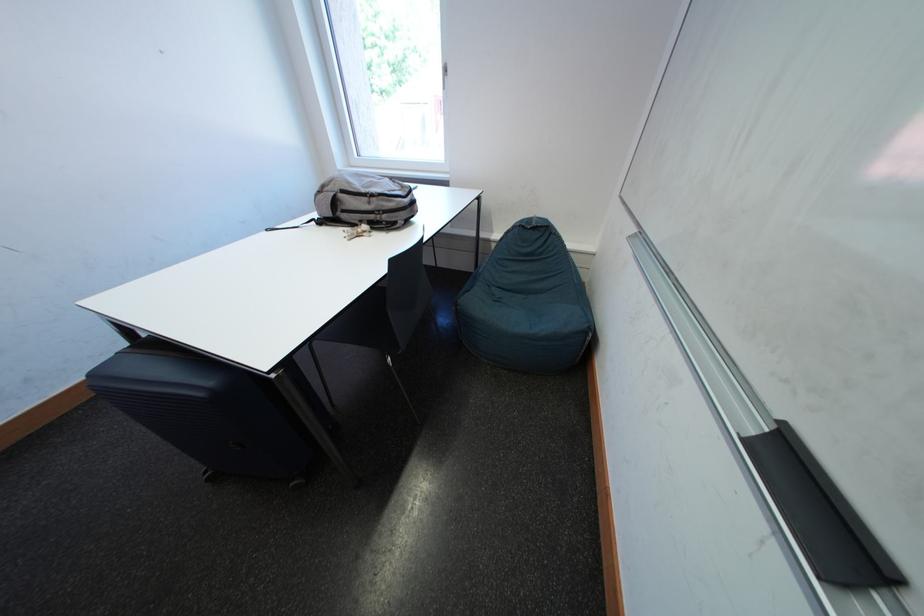
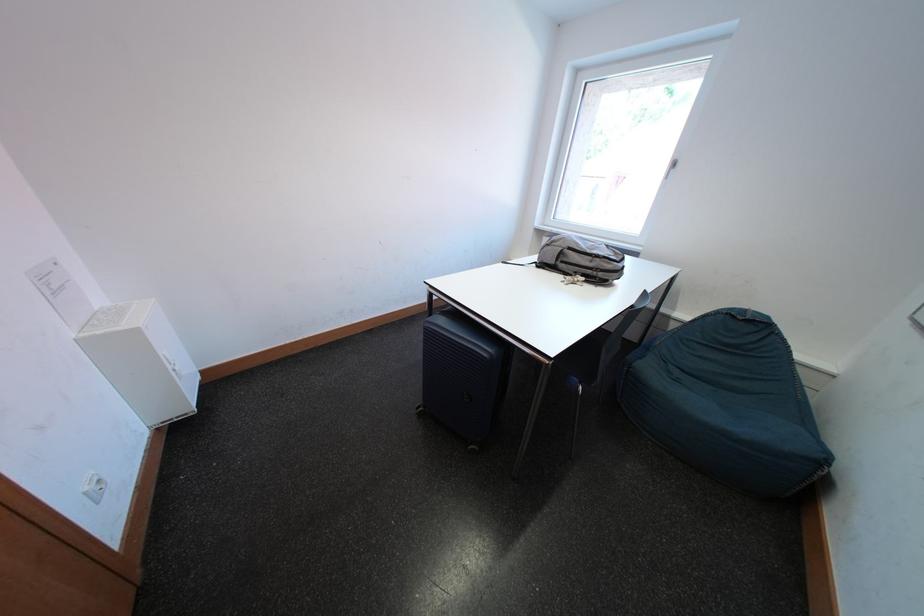
In the second image, find the point that corresponds to pixel 507 296 in the first image.

(687, 376)